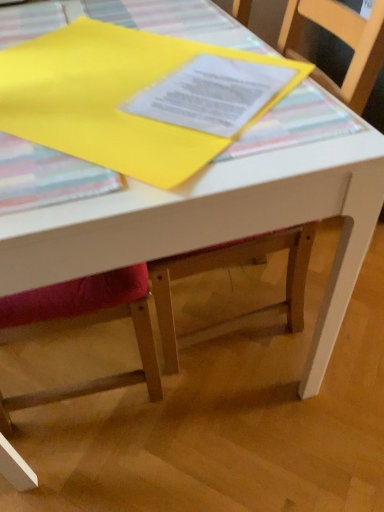
In order to face yellow matte folder at upper center, should I rotate leftwards or rightwards?

Rotate left and turn 11.066 degrees.

The image size is (384, 512). What do you see at coordinates (125, 98) in the screenshot?
I see `yellow matte folder at upper center` at bounding box center [125, 98].

Where is `yellow matte folder at upper center`? Image resolution: width=384 pixels, height=512 pixels. yellow matte folder at upper center is located at coordinates (125, 98).

What is the approximate height of yellow matte folder at upper center?

0.39 inches.

I want to click on yellow matte folder at upper center, so click(125, 98).